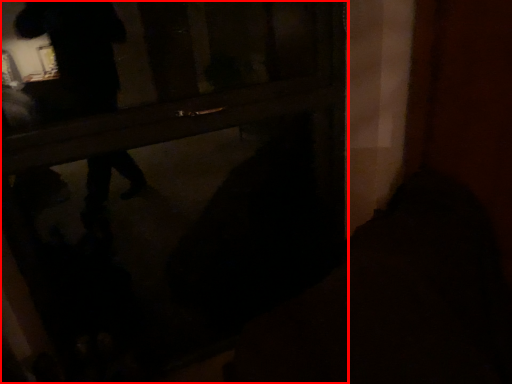
Question: Observing the image, what is the correct spatial positioning of door (annotated by the red box) in reference to dark?

Choices:
 (A) right
 (B) left

Answer: (B)